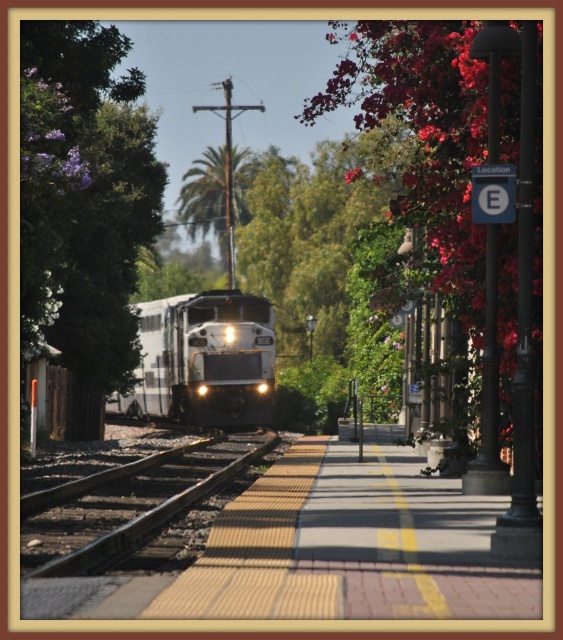
Question: Among these points, which one is farthest from the camera?

Choices:
 (A) (257, 340)
 (B) (117, 529)
 (C) (42, 116)
 (D) (495, 84)

Answer: (A)

Question: Can you confirm if purple leafy tree at left is positioned above vivid pink flowers at right?

Choices:
 (A) yes
 (B) no

Answer: (B)

Question: Can you confirm if black asphalt train track at center is positioned to the right of green leafy palm at center?

Choices:
 (A) yes
 (B) no

Answer: (A)

Question: Which object is the closest to the white glossy passenger train at center?

Choices:
 (A) purple leafy tree at left
 (B) black asphalt train track at center

Answer: (A)

Question: Which of the following is the farthest from the observer?

Choices:
 (A) white glossy passenger train at center
 (B) purple leafy tree at left

Answer: (A)

Question: Is vivid pink flowers at right further to the viewer compared to black asphalt train track at center?

Choices:
 (A) no
 (B) yes

Answer: (B)